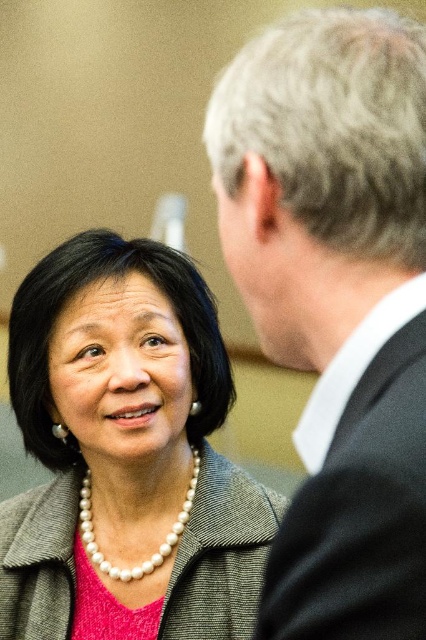
You are standing in the scene and want to move from point A to point B. Point A is at coordinates point (396,396) and point B is at coordinates point (169,268). Since point A is in front of point B, will moving from A to B require going backward?

Yes, moving from point A to point B will require going backward because point A is in front of point B, so to reach point B from point A, you must move in the opposite direction.

You are a photographer adjusting your camera settings to focus on two points in the image. The first point is at coordinates point (379, 410) and the second is at point (207, 499). Which point should you prioritize focusing on to ensure it appears sharp in the final photo?

Point (379, 410) is closer to the camera than point (207, 499), so focusing on it first will ensure it appears sharp in the photo.

You are an event planner arranging seating for a formal dinner. You have two guests wearing the black wool suit at upper right and the gray textured jacket at center. Which guest requires a larger seating area due to their attire?

The gray textured jacket at center requires a larger seating area because it occupies more space than the black wool suit at upper right.